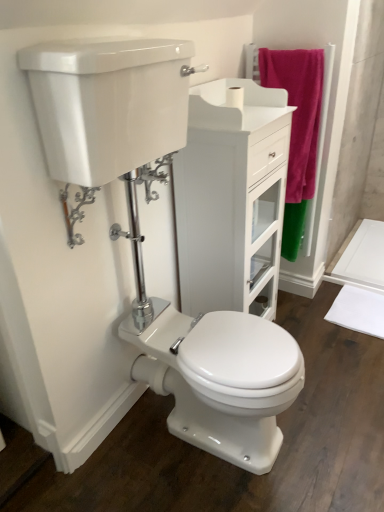
Question: From a real-world perspective, relative to chrome metallic lever at upper left, the second plumbing fixture from the right, is polished chrome flush handle at center, which is the second plumbing fixture in front-to-back order, vertically above or below?

Choices:
 (A) below
 (B) above

Answer: (A)

Question: Based on their sizes in the image, would you say polished chrome flush handle at center, which appears as the 2th plumbing fixture when viewed from the left, is bigger or smaller than chrome metallic lever at upper left, the first plumbing fixture in the front-to-back sequence?

Choices:
 (A) big
 (B) small

Answer: (A)

Question: Based on their relative distances, which object is nearer to the white matte toilet paper at upper center?

Choices:
 (A) pink fuzzy towel at upper right
 (B) chrome metallic lever at upper left, the second plumbing fixture from the right
 (C) white glossy cabinet at center
 (D) polished chrome flush handle at center, marked as the first plumbing fixture in a top-to-bottom arrangement

Answer: (A)

Question: Which of these objects is positioned farthest from the pink fuzzy towel at upper right?

Choices:
 (A) chrome metallic lever at upper left, the first plumbing fixture in the front-to-back sequence
 (B) white glossy cabinet at center
 (C) white matte toilet paper at upper center
 (D) polished chrome flush handle at center, which is the second plumbing fixture from bottom to top

Answer: (A)